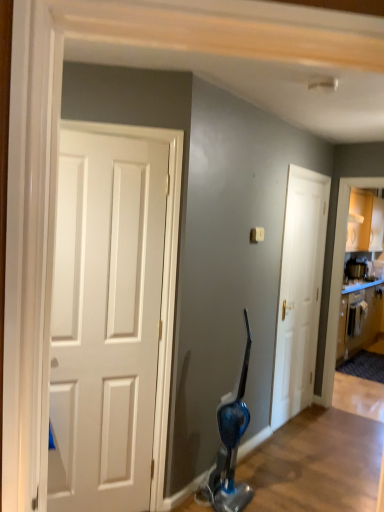
Question: From a real-world perspective, is wooden cabinet at right positioned over white matte door at center based on gravity?

Choices:
 (A) yes
 (B) no

Answer: (B)

Question: Is wooden cabinet at right thinner than white matte door at center?

Choices:
 (A) no
 (B) yes

Answer: (A)

Question: Is wooden cabinet at right oriented away from white matte door at center?

Choices:
 (A) yes
 (B) no

Answer: (B)

Question: Could you tell me if wooden cabinet at right is turned towards white matte door at center?

Choices:
 (A) yes
 (B) no

Answer: (B)

Question: Is wooden cabinet at right bigger than white matte door at center?

Choices:
 (A) yes
 (B) no

Answer: (A)

Question: Would you say wooden cabinet at right is to the left or to the right of white matte door at center in the picture?

Choices:
 (A) left
 (B) right

Answer: (B)

Question: From a real-world perspective, is wooden cabinet at right above or below white matte door at center?

Choices:
 (A) above
 (B) below

Answer: (B)

Question: Is point (350, 352) closer or farther from the camera than point (291, 374)?

Choices:
 (A) closer
 (B) farther

Answer: (B)

Question: From the image's perspective, is wooden cabinet at right located above or below white matte door at center?

Choices:
 (A) below
 (B) above

Answer: (A)

Question: Considering their positions, is wooden cabinet at right located in front of or behind metallic silver toaster at upper right?

Choices:
 (A) behind
 (B) front

Answer: (B)

Question: Looking at the image, does wooden cabinet at right seem bigger or smaller compared to metallic silver toaster at upper right?

Choices:
 (A) big
 (B) small

Answer: (A)

Question: Is wooden cabinet at right wider or thinner than metallic silver toaster at upper right?

Choices:
 (A) thin
 (B) wide

Answer: (B)

Question: Visually, is wooden cabinet at right positioned to the left or to the right of metallic silver toaster at upper right?

Choices:
 (A) right
 (B) left

Answer: (A)

Question: Is white matte door at center in front of or behind metallic silver toaster at upper right in the image?

Choices:
 (A) behind
 (B) front

Answer: (B)

Question: Visually, is white matte door at center positioned to the left or to the right of metallic silver toaster at upper right?

Choices:
 (A) left
 (B) right

Answer: (A)